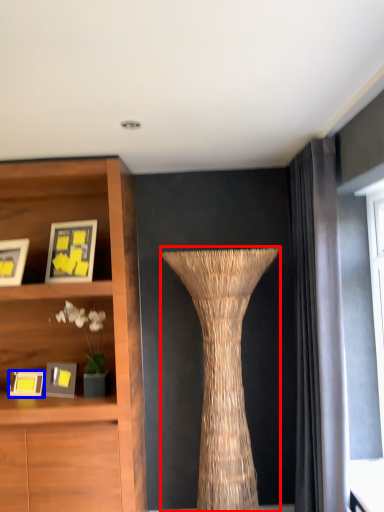
Question: Which point is further to the camera, vase (highlighted by a red box) or picture frame (highlighted by a blue box)?

Choices:
 (A) vase
 (B) picture frame

Answer: (B)